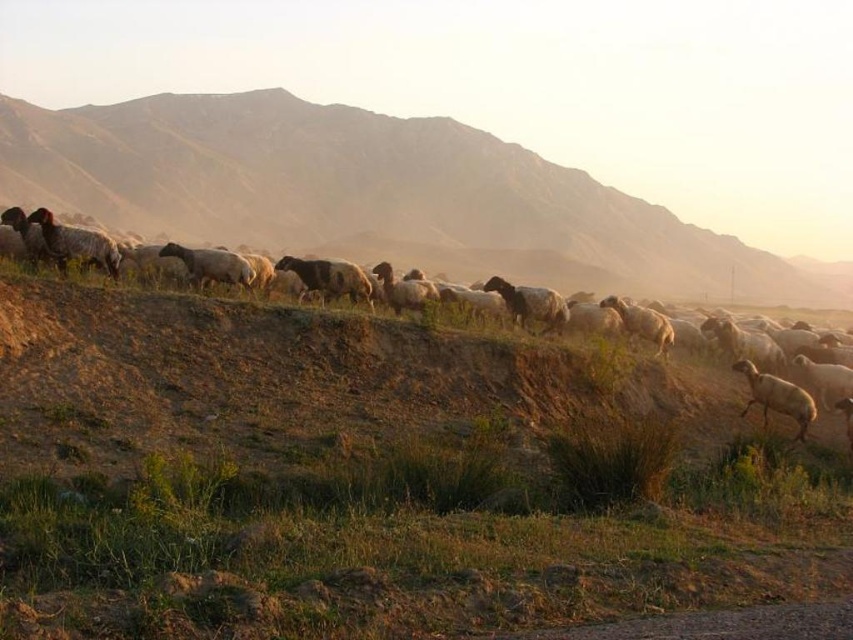
Question: Is green grassy at lower center wider than white woolly sheep at center-right?

Choices:
 (A) yes
 (B) no

Answer: (B)

Question: Which of these objects is positioned closest to the green grassy at lower center?

Choices:
 (A) brown grassy hillside at center
 (B) white woolly sheep at center-right

Answer: (B)

Question: Can you confirm if green grassy at lower center is positioned to the right of white woolly sheep at center?

Choices:
 (A) yes
 (B) no

Answer: (B)

Question: Which object appears farthest from the camera in this image?

Choices:
 (A) brown grassy hillside at center
 (B) green grassy at lower center
 (C) white woolly sheep at center-right
 (D) white woolly sheep at center

Answer: (A)

Question: Which of the following is the closest to the observer?

Choices:
 (A) white woolly sheep at center
 (B) green grassy at lower center
 (C) white woolly sheep at center-right

Answer: (B)

Question: Observing the image, what is the correct spatial positioning of brown grassy hillside at center in reference to white woolly sheep at center?

Choices:
 (A) below
 (B) above

Answer: (B)